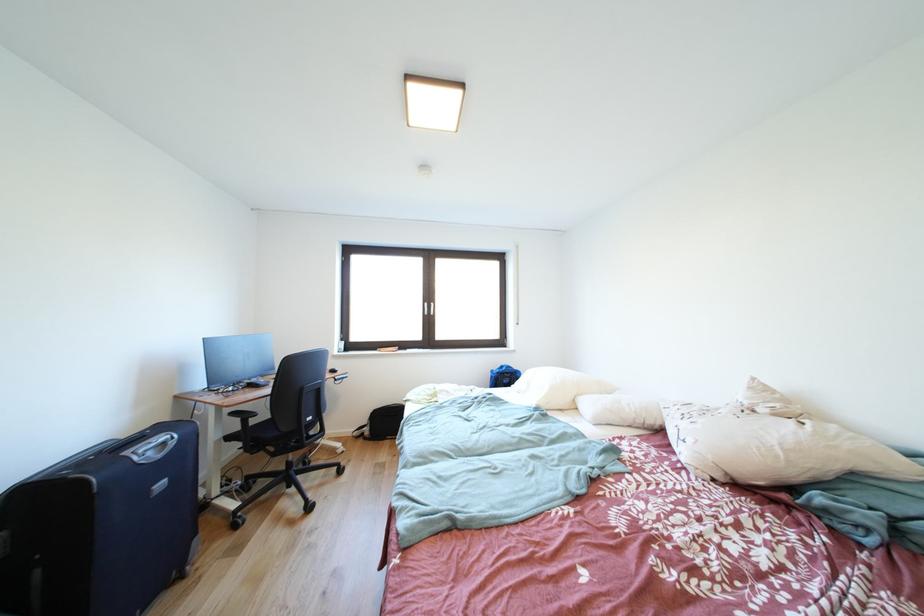
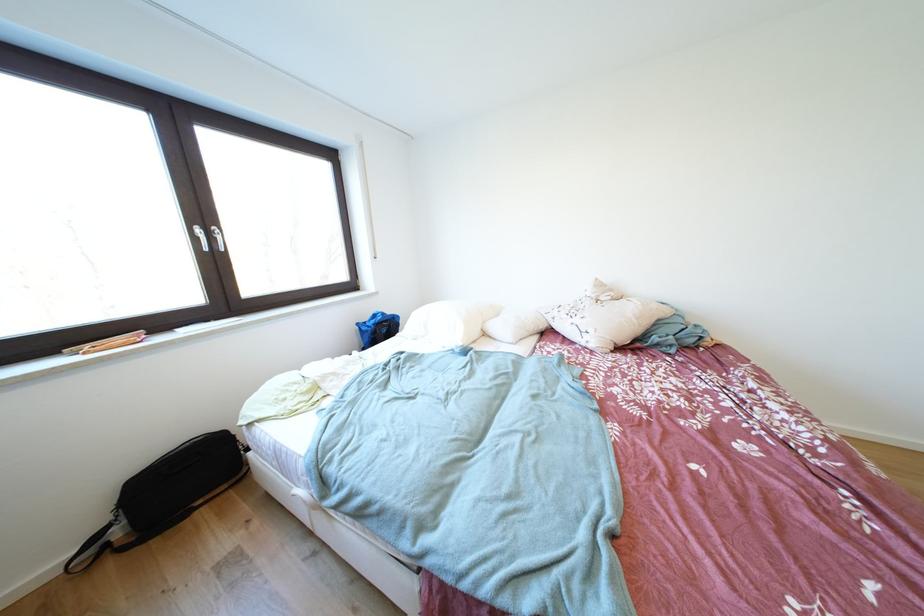
In the second image, find the point that corresponds to point 762,383 in the first image.

(604, 284)